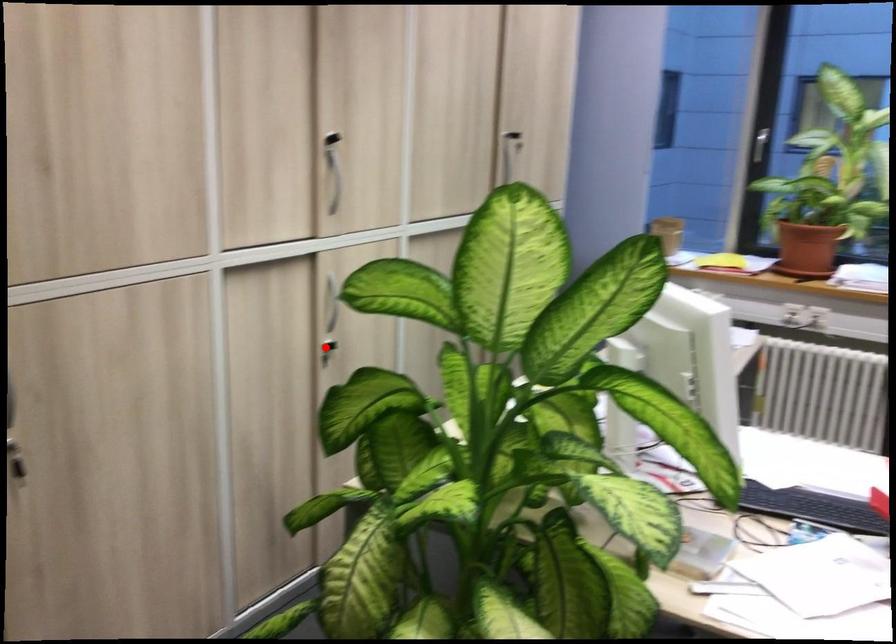
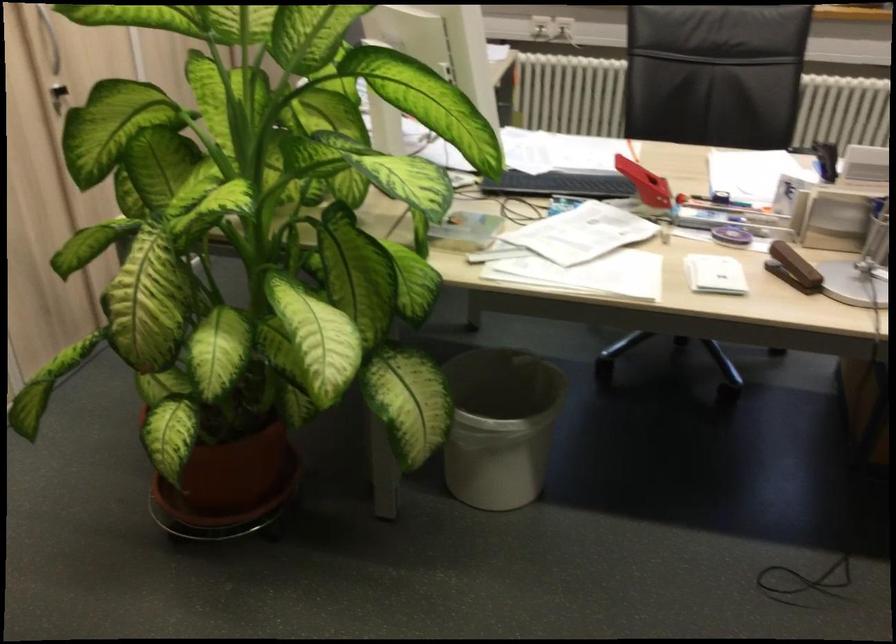
In the second image, find the point that corresponds to the highlighted location in the first image.

(57, 96)